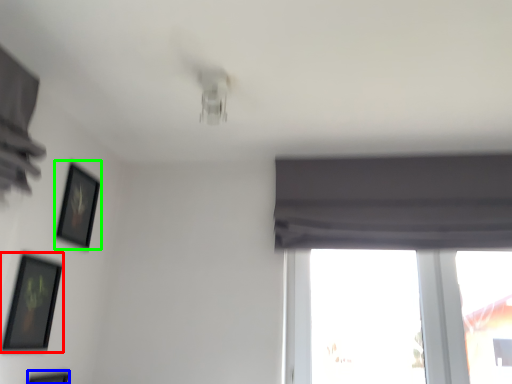
Question: Estimate the real-world distances between objects in this image. Which object is closer to picture frame (highlighted by a red box), picture frame (highlighted by a blue box) or picture frame (highlighted by a green box)?

Choices:
 (A) picture frame
 (B) picture frame

Answer: (A)